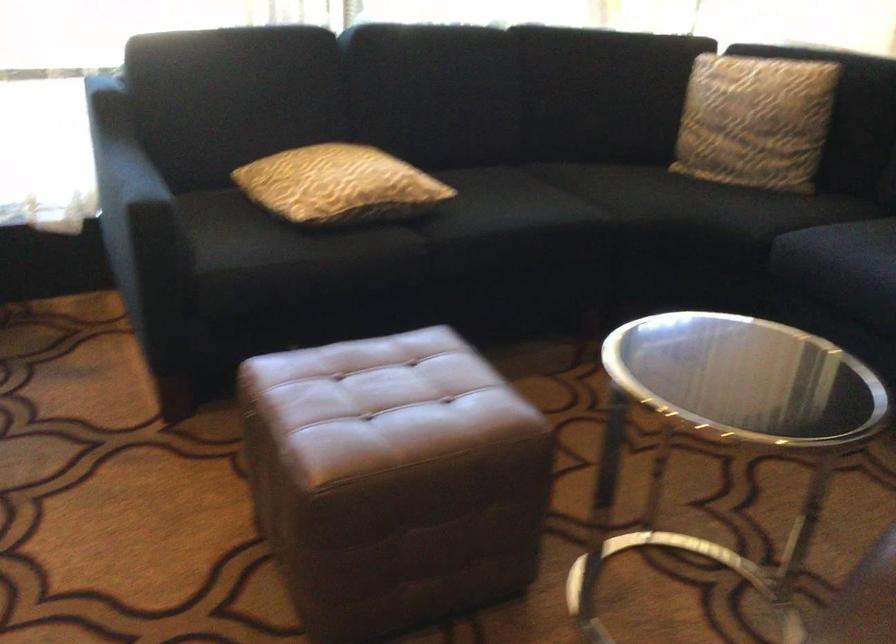
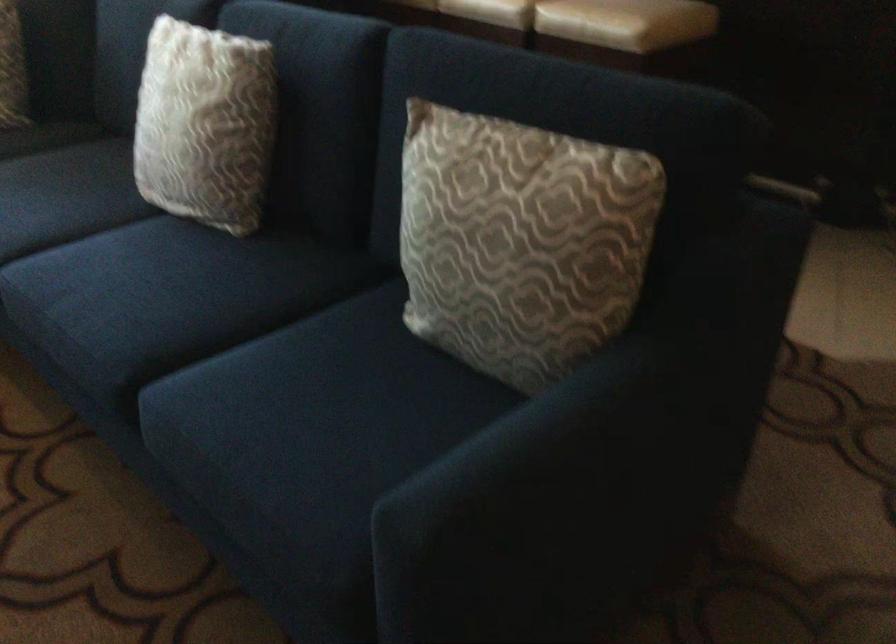
Question: The images are taken continuously from a first-person perspective. In which direction are you moving?

Choices:
 (A) Left
 (B) Right
 (C) Forward
 (D) Backward

Answer: (B)